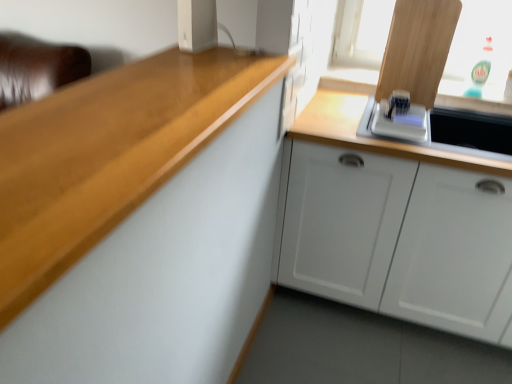
Question: Is white plastic toaster at upper right, the 1th appliance when ordered from right to left, completely or partially inside white glossy microwave at upper right?

Choices:
 (A) yes
 (B) no

Answer: (B)

Question: Does white glossy microwave at upper right lie behind white plastic toaster at upper right, the 1th appliance when ordered from right to left?

Choices:
 (A) yes
 (B) no

Answer: (B)

Question: From a real-world perspective, is white glossy microwave at upper right below white plastic toaster at upper right, the 1th appliance when ordered from right to left?

Choices:
 (A) no
 (B) yes

Answer: (B)

Question: Is white glossy microwave at upper right turned away from white plastic toaster at upper right, arranged as the first appliance when viewed from the back?

Choices:
 (A) yes
 (B) no

Answer: (B)

Question: Considering the relative sizes of white glossy microwave at upper right and white plastic toaster at upper right, arranged as the first appliance when viewed from the back, in the image provided, is white glossy microwave at upper right bigger than white plastic toaster at upper right, arranged as the first appliance when viewed from the back,?

Choices:
 (A) yes
 (B) no

Answer: (A)

Question: Does point (466, 288) appear closer or farther from the camera than point (360, 142)?

Choices:
 (A) closer
 (B) farther

Answer: (B)

Question: Based on their positions, is white matte cabinet at lower right, positioned as the 2th cabinetry in front-to-back order, located to the left or right of white glossy microwave at upper right?

Choices:
 (A) right
 (B) left

Answer: (B)

Question: From the image's perspective, is white matte cabinet at lower right, positioned as the 2th cabinetry in front-to-back order, located above or below white glossy microwave at upper right?

Choices:
 (A) below
 (B) above

Answer: (A)

Question: Is white matte cabinet at lower right, marked as the first cabinetry in a back-to-front arrangement, wider or thinner than white glossy microwave at upper right?

Choices:
 (A) wide
 (B) thin

Answer: (A)

Question: Would you say white glossy microwave at upper right is inside or outside white plastic speaker at upper center, the second appliance viewed from the right?

Choices:
 (A) inside
 (B) outside

Answer: (B)

Question: From the image's perspective, is white glossy microwave at upper right located above or below white plastic speaker at upper center, the second appliance viewed from the right?

Choices:
 (A) above
 (B) below

Answer: (B)

Question: From a real-world perspective, is white glossy microwave at upper right positioned above or below white plastic speaker at upper center, positioned as the 2th appliance in back-to-front order?

Choices:
 (A) above
 (B) below

Answer: (B)

Question: Would you say white glossy microwave at upper right is to the left or to the right of white plastic speaker at upper center, which is the 1th appliance from left to right, in the picture?

Choices:
 (A) right
 (B) left

Answer: (A)

Question: In terms of height, does white glossy microwave at upper right look taller or shorter compared to white plastic toaster at upper right, which is the second appliance from left to right?

Choices:
 (A) short
 (B) tall

Answer: (B)

Question: Is point (460, 163) closer or farther from the camera than point (393, 127)?

Choices:
 (A) closer
 (B) farther

Answer: (A)